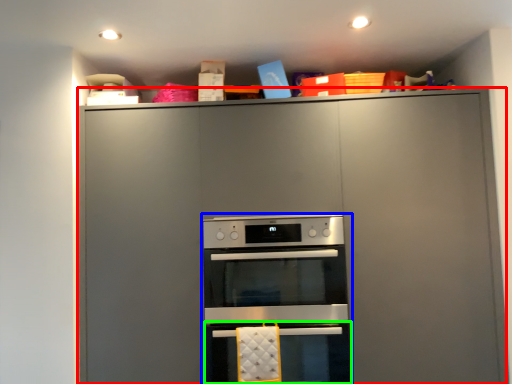
Question: Considering the real-world distances, which object is farthest from cabinetry (highlighted by a red box)? oven (highlighted by a blue box) or oven (highlighted by a green box)?

Choices:
 (A) oven
 (B) oven

Answer: (B)